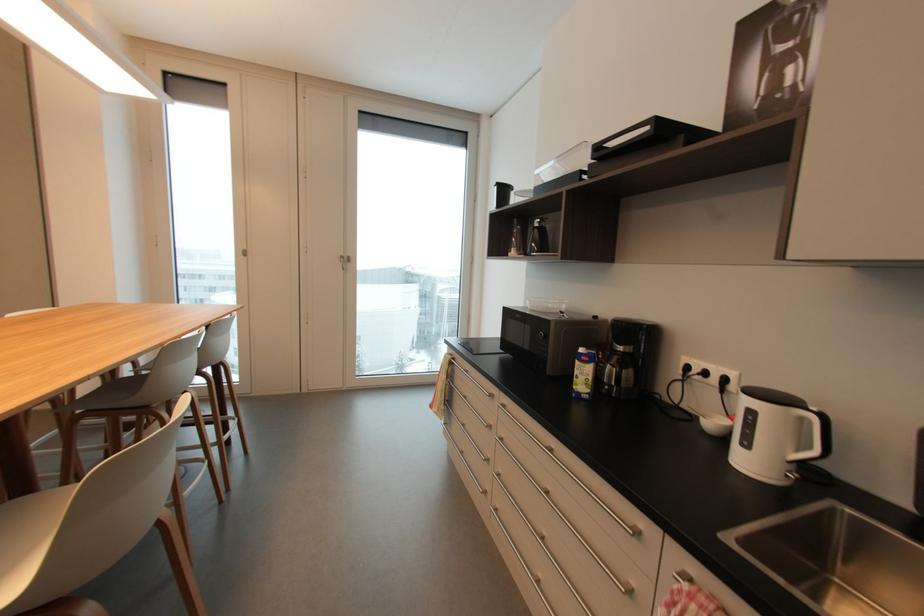
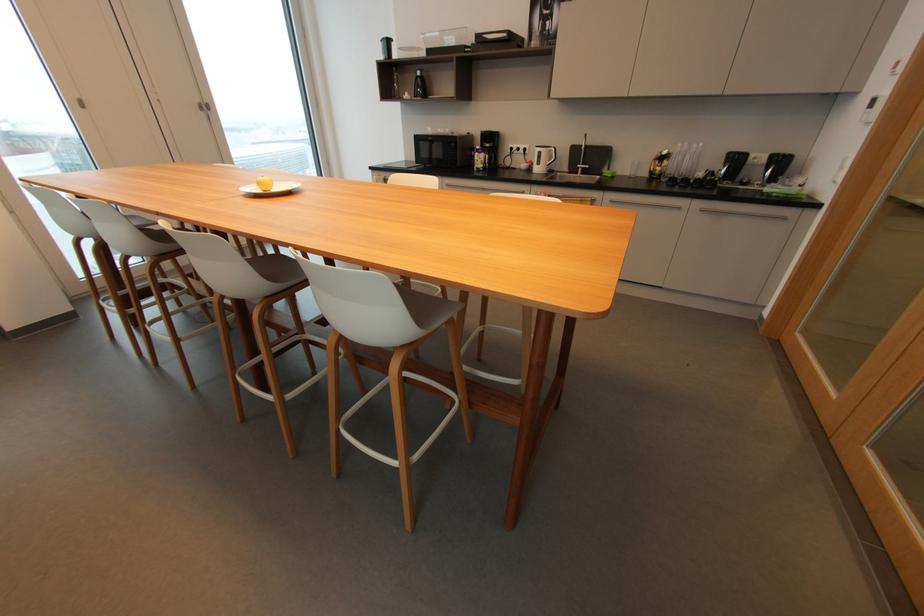
Find the pixel in the second image that matches (247,254) in the first image.

(81, 103)